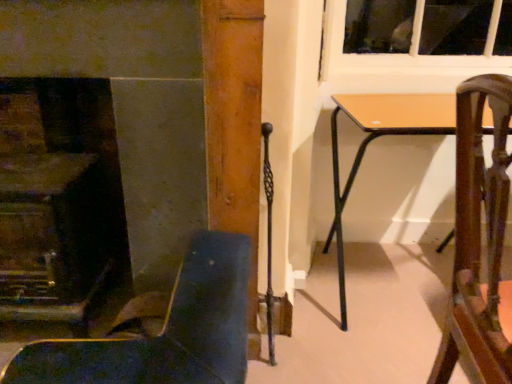
You are a GUI agent. You are given a task and a screenshot of the screen. Output one action in this format:
    pyautogui.click(x=<x>, y=<y>)
    Task: Click on the free point above light brown wooden table at center (from a real-world perspective)
    
    Given the screenshot: What is the action you would take?
    pyautogui.click(x=410, y=107)